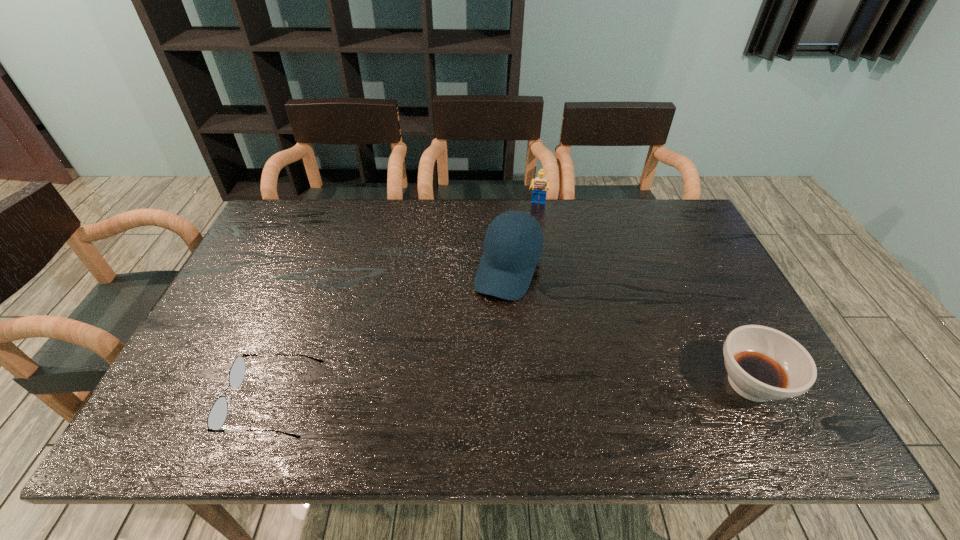
In order to click on spectacles in this screenshot , I will do click(218, 413).

Identify the location of the leftmost object. The height and width of the screenshot is (540, 960). (218, 413).

Where is `the rightmost object`? the rightmost object is located at coordinates (763, 364).

This screenshot has width=960, height=540. In order to click on soup bowl in this screenshot , I will do `click(763, 364)`.

Find the location of `the third nearest object`. the third nearest object is located at coordinates (513, 243).

You are a GUI agent. You are given a task and a screenshot of the screen. Output one action in this format:
    pyautogui.click(x=<x>, y=<y>)
    Task: Click on the tallest object
    Image resolution: width=960 pixels, height=540 pixels.
    Given the screenshot: What is the action you would take?
    pyautogui.click(x=513, y=243)

Locate an element on the screen. This screenshot has height=540, width=960. Lego is located at coordinates (x=540, y=185).

Locate an element on the screen. The width and height of the screenshot is (960, 540). the second tallest object is located at coordinates (540, 185).

This screenshot has height=540, width=960. In order to click on vacant space located on the lenses of the spectacles in this screenshot , I will do `click(210, 401)`.

Locate an element on the screen. The image size is (960, 540). vacant space located on the lenses of the spectacles is located at coordinates (170, 401).